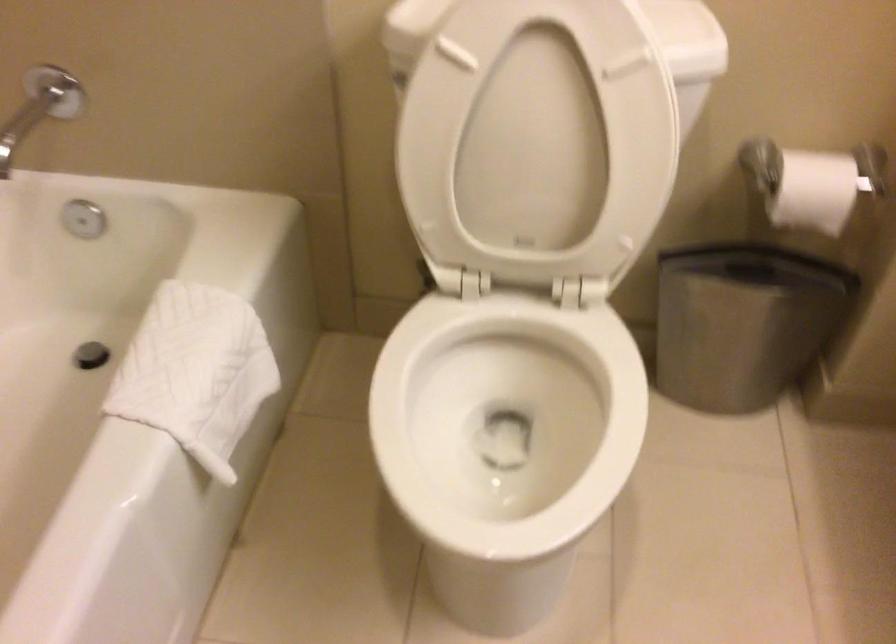
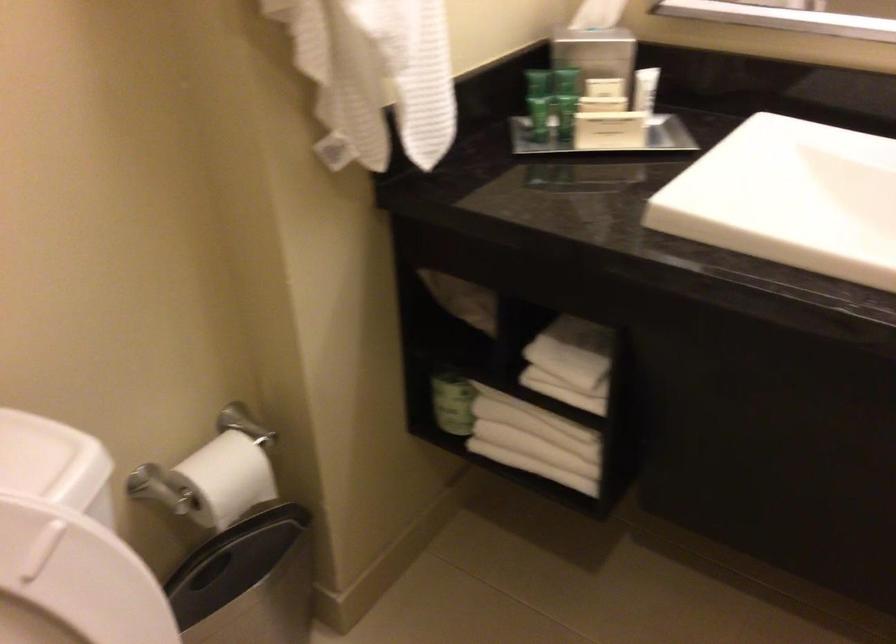
In the second image, find the point that corresponds to [797,167] in the first image.

(211, 480)